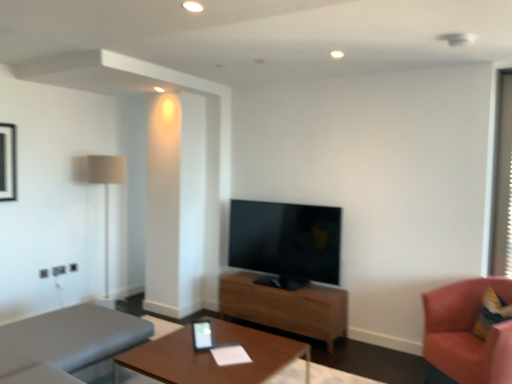
Measure the distance between gray fabric studio couch at lower left and camera.

They are 7.40 feet apart.

What do you see at coordinates (286, 307) in the screenshot? I see `wooden table at center, the second table in the front-to-back sequence` at bounding box center [286, 307].

Identify the location of wooden table at center, acting as the second table starting from the back. (213, 358).

The image size is (512, 384). What are the coordinates of `black glossy picture frame at upper left` in the screenshot? It's located at (8, 162).

What is the approximate height of transparent plastic window screen at right?

transparent plastic window screen at right is 1.67 meters tall.

Identify the location of matte black tv at center. (286, 242).

Describe the element at coordinates (286, 242) in the screenshot. This screenshot has height=384, width=512. I see `matte black tv at center` at that location.

You are a GUI agent. You are given a task and a screenshot of the screen. Output one action in this format:
    pyautogui.click(x=<x>, y=<y>)
    Task: Click on the gray fabric studio couch at lower left
    The image size is (512, 384).
    Given the screenshot: What is the action you would take?
    pyautogui.click(x=66, y=343)

Is black glossy picture frame at upper left taller or shorter than wooden table at center, the second table in the front-to-back sequence?

black glossy picture frame at upper left is taller than wooden table at center, the second table in the front-to-back sequence.

From the image's perspective, which is below, black glossy picture frame at upper left or wooden table at center, the second table in the front-to-back sequence?

wooden table at center, the second table in the front-to-back sequence.

Considering the sizes of objects black glossy picture frame at upper left and wooden table at center, the second table in the front-to-back sequence, in the image provided, who is thinner, black glossy picture frame at upper left or wooden table at center, the second table in the front-to-back sequence,?

black glossy picture frame at upper left.

In terms of size, does black glossy picture frame at upper left appear bigger or smaller than wooden table at center, the second table in the front-to-back sequence?

In the image, black glossy picture frame at upper left appears to be smaller than wooden table at center, the second table in the front-to-back sequence.

Considering the relative sizes of transparent plastic window screen at right and beige fabric lamp at left in the image provided, is transparent plastic window screen at right taller than beige fabric lamp at left?

No, transparent plastic window screen at right is not taller than beige fabric lamp at left.

From the image's perspective, relative to beige fabric lamp at left, is transparent plastic window screen at right above or below?

Clearly, from the image's perspective, transparent plastic window screen at right is above beige fabric lamp at left.

Does transparent plastic window screen at right have a lesser width compared to beige fabric lamp at left?

Yes.

Considering the sizes of objects transparent plastic window screen at right and beige fabric lamp at left in the image provided, who is smaller, transparent plastic window screen at right or beige fabric lamp at left?

Smaller between the two is transparent plastic window screen at right.

Between matte black tv at center and wooden table at center, which appears as the 1th table when viewed from the back, which one has larger size?

matte black tv at center is bigger.

Could you tell me if matte black tv at center is facing wooden table at center, which appears as the 1th table when viewed from the back?

No, matte black tv at center does not turn towards wooden table at center, which appears as the 1th table when viewed from the back.

Is matte black tv at center to the right of wooden table at center, which appears as the 1th table when viewed from the back, from the viewer's perspective?

Correct, you'll find matte black tv at center to the right of wooden table at center, which appears as the 1th table when viewed from the back.

Considering the points (293, 290) and (245, 293), which point is in front, point (293, 290) or point (245, 293)?

The point (293, 290) is closer to the camera.

How many degrees apart are the facing directions of beige fabric lamp at left and wooden table at center, the first table viewed from the front?

89.7 degrees separate the facing orientations of beige fabric lamp at left and wooden table at center, the first table viewed from the front.

From the image's perspective, is beige fabric lamp at left located beneath wooden table at center, the first table viewed from the front?

No.

Is beige fabric lamp at left completely or partially outside of wooden table at center, acting as the second table starting from the back?

Yes, beige fabric lamp at left is located beyond the bounds of wooden table at center, acting as the second table starting from the back.

From a real-world perspective, is beige fabric lamp at left under wooden table at center, acting as the second table starting from the back?

No.

Visually, is pink fabric chair at right positioned to the left or to the right of gray fabric studio couch at lower left?

pink fabric chair at right is to the right of gray fabric studio couch at lower left.

Between pink fabric chair at right and gray fabric studio couch at lower left, which one is positioned in front?

gray fabric studio couch at lower left.

The width and height of the screenshot is (512, 384). I want to click on studio couch above the pink fabric chair at right (from the image's perspective), so click(66, 343).

The height and width of the screenshot is (384, 512). What are the coordinates of `television on the right of the beige fabric lamp at left` in the screenshot? It's located at (286, 242).

How many degrees apart are the facing directions of matte black tv at center and beige fabric lamp at left?

88.7 degrees separate the facing orientations of matte black tv at center and beige fabric lamp at left.

Is beige fabric lamp at left surrounded by matte black tv at center?

No, beige fabric lamp at left is not inside matte black tv at center.

Is matte black tv at center oriented towards beige fabric lamp at left?

No.

Measure the distance from wooden table at center, which appears as the 1th table when viewed from the back, to gray fabric studio couch at lower left.

The distance of wooden table at center, which appears as the 1th table when viewed from the back, from gray fabric studio couch at lower left is 5.19 feet.

Between point (337, 329) and point (101, 354), which one is positioned behind?

The point (337, 329) is more distant.

How different are the orientations of wooden table at center, the second table in the front-to-back sequence, and gray fabric studio couch at lower left in degrees?

The angle between the facing direction of wooden table at center, the second table in the front-to-back sequence, and the facing direction of gray fabric studio couch at lower left is 178 degrees.

Could you tell me if wooden table at center, the second table in the front-to-back sequence, is turned towards gray fabric studio couch at lower left?

Yes, wooden table at center, the second table in the front-to-back sequence, is aimed at gray fabric studio couch at lower left.

Where is `picture frame located behind the wooden table at center, which appears as the 1th table when viewed from the back`? The height and width of the screenshot is (384, 512). picture frame located behind the wooden table at center, which appears as the 1th table when viewed from the back is located at coordinates (8, 162).

At what (x,y) coordinates should I click in order to perform the action: click on lamp on the left side of transparent plastic window screen at right. Please return your answer as a coordinate pair (x, y). The image size is (512, 384). Looking at the image, I should click on (106, 191).

When comparing their distances from wooden table at center, which appears as the 1th table when viewed from the back, does black glossy picture frame at upper left or pink fabric chair at right seem closer?

pink fabric chair at right is positioned closer to the anchor wooden table at center, which appears as the 1th table when viewed from the back.

Estimate the real-world distances between objects in this image. Which object is further from matte black tv at center, transparent plastic window screen at right or pink fabric chair at right?

transparent plastic window screen at right is further to matte black tv at center.

Estimate the real-world distances between objects in this image. Which object is closer to transparent plastic window screen at right, wooden table at center, acting as the second table starting from the back, or wooden table at center, which appears as the 1th table when viewed from the back?

wooden table at center, which appears as the 1th table when viewed from the back, is positioned closer to the anchor transparent plastic window screen at right.

Based on their spatial positions, is transparent plastic window screen at right or matte black tv at center closer to gray fabric studio couch at lower left?

matte black tv at center lies closer to gray fabric studio couch at lower left than the other object.

Estimate the real-world distances between objects in this image. Which object is closer to wooden table at center, the first table viewed from the front, transparent plastic window screen at right or matte black tv at center?

matte black tv at center is closer to wooden table at center, the first table viewed from the front.

From the image, which object appears to be farther from beige fabric lamp at left, wooden table at center, the second table in the front-to-back sequence, or gray fabric studio couch at lower left?

wooden table at center, the second table in the front-to-back sequence, lies further to beige fabric lamp at left than the other object.

From the picture: Based on their spatial positions, is wooden table at center, which appears as the 1th table when viewed from the back, or transparent plastic window screen at right closer to wooden table at center, the first table viewed from the front?

wooden table at center, which appears as the 1th table when viewed from the back.

Looking at the image, which one is located further to beige fabric lamp at left, gray fabric studio couch at lower left or matte black tv at center?

Based on the image, gray fabric studio couch at lower left appears to be further to beige fabric lamp at left.

What are the coordinates of `studio couch located between black glossy picture frame at upper left and pink fabric chair at right in the left-right direction` in the screenshot? It's located at (66, 343).

You are a GUI agent. You are given a task and a screenshot of the screen. Output one action in this format:
    pyautogui.click(x=<x>, y=<y>)
    Task: Click on the television between wooden table at center, the first table viewed from the front, and transparent plastic window screen at right from left to right
    This screenshot has width=512, height=384.
    Given the screenshot: What is the action you would take?
    286,242

Locate an element on the screen. Image resolution: width=512 pixels, height=384 pixels. television located between black glossy picture frame at upper left and transparent plastic window screen at right in the left-right direction is located at coordinates (286, 242).

Identify the location of studio couch located between beige fabric lamp at left and wooden table at center, which appears as the 1th table when viewed from the back, in the left-right direction. (66, 343).